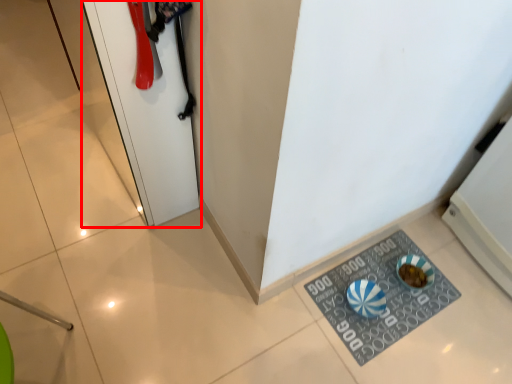
Question: Considering the relative positions of door (annotated by the red box) and doormat in the image provided, where is door (annotated by the red box) located with respect to the staircase?

Choices:
 (A) left
 (B) right

Answer: (A)